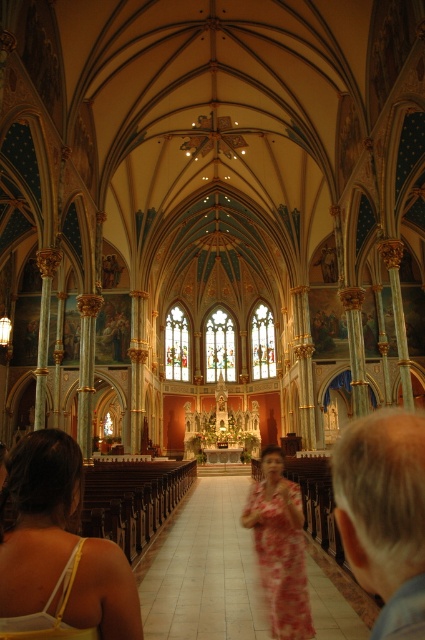
You are a visitor standing at the entrance of the church. You notice a matte yellow tank top at lower left and a white tile aisle at center. Which object is closer to you?

The matte yellow tank top at lower left is closer to you because it is positioned over the white tile aisle at center, indicating it is in front of it.

You are a photographer inside the church and want to capture a photo of both the matte yellow tank top at lower left and the gray hair at right. Which object should you adjust your camera angle to focus on first if you want to include both in the frame?

The matte yellow tank top at lower left is positioned on the left side of gray hair at right, so you should focus on the matte yellow tank top at lower left first to ensure both are in the frame.

You are standing at the entrance of the church and see two points marked in the image. The first point is at coordinates point (28, 632) and the second is at point (229, 634). Which point is closer to you?

Point (28, 632) is in front of point (229, 634), so it is closer to you.